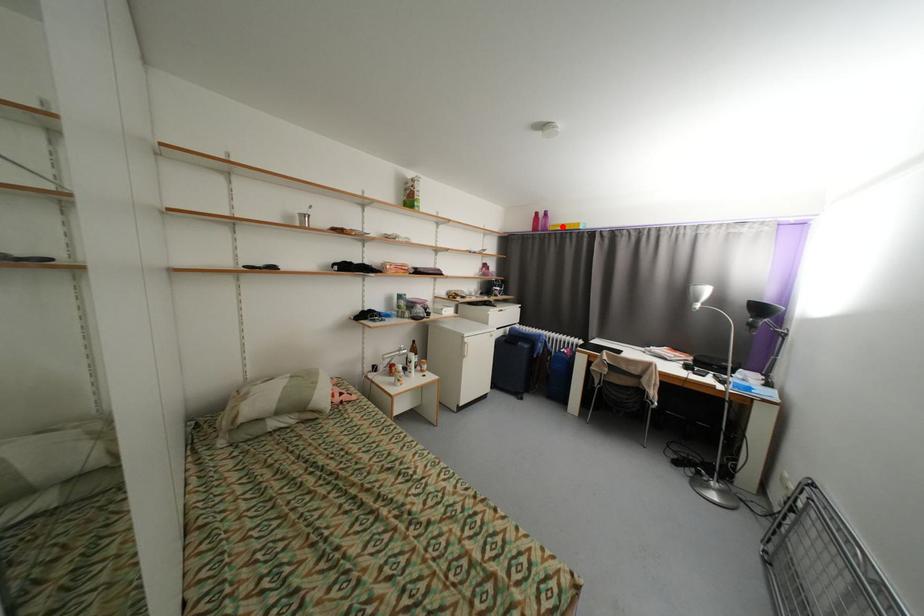
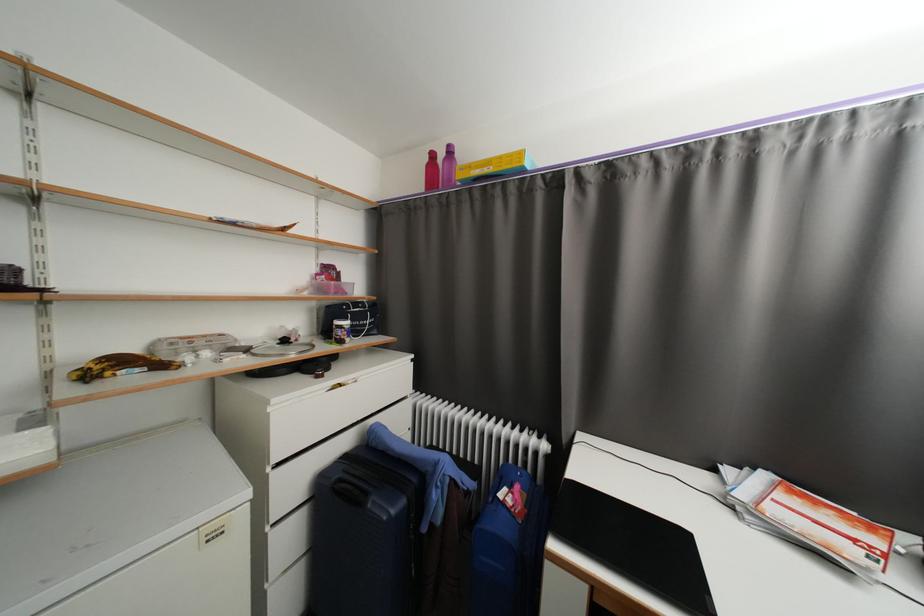
Question: I am providing you with two images of the same scene from different viewpoints. A red point is marked on the first image. At the location where the point appears in image 1, is it still visible in image 2?

Choices:
 (A) Yes
 (B) No

Answer: (A)